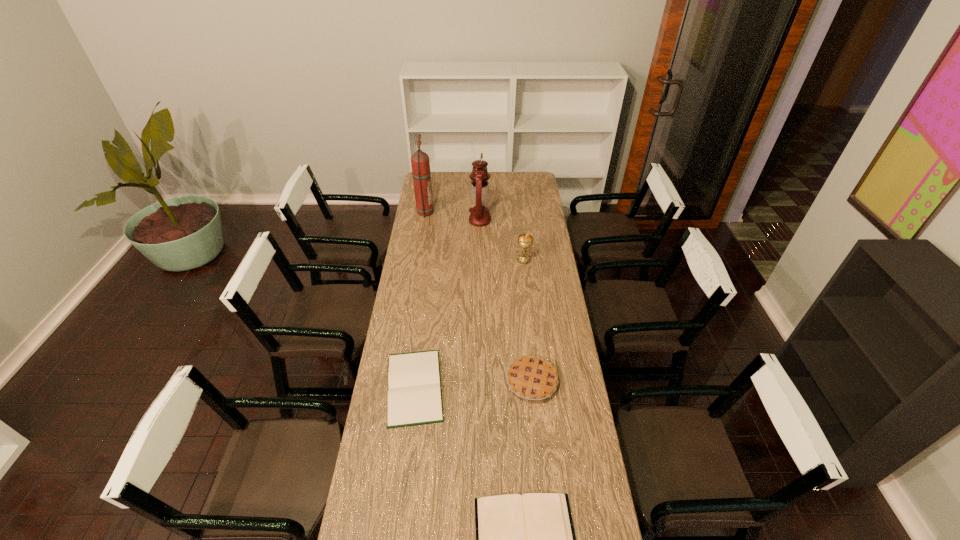
I want to click on free space between the fire extinguisher and the fourth nearest object, so click(473, 236).

Where is `empty location between the fire extinguisher and the farther hardback book`? The width and height of the screenshot is (960, 540). empty location between the fire extinguisher and the farther hardback book is located at coordinates (419, 300).

This screenshot has width=960, height=540. Find the location of `free area in between the oil lamp and the fire extinguisher`. free area in between the oil lamp and the fire extinguisher is located at coordinates (451, 216).

The height and width of the screenshot is (540, 960). I want to click on free space between the oil lamp and the pie, so (506, 301).

Image resolution: width=960 pixels, height=540 pixels. Find the location of `free space between the oil lamp and the fire extinguisher`. free space between the oil lamp and the fire extinguisher is located at coordinates (451, 216).

Identify the location of free area in between the oil lamp and the fourth shortest object. (502, 240).

This screenshot has height=540, width=960. I want to click on free space between the oil lamp and the left hardback book, so [447, 303].

Locate an element on the screen. unoccupied position between the pie and the left hardback book is located at coordinates (473, 384).

Image resolution: width=960 pixels, height=540 pixels. Find the location of `object that is the fourth closest one to the oil lamp`. object that is the fourth closest one to the oil lamp is located at coordinates (530, 377).

This screenshot has width=960, height=540. What are the coordinates of `object that stands as the fifth closest to the chalice` in the screenshot? It's located at (529, 539).